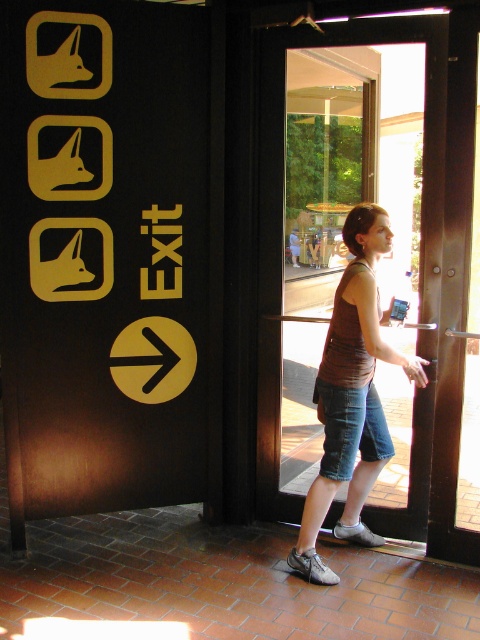
You are at the entrance of a building and need to exit. You see a matte black sign at exit right and a transparent glass door at center. Which object is taller?

The matte black sign at exit right is much taller than the transparent glass door at center.

You are standing at the entrance of a building and want to locate the matte black sign at exit right. According to the coordinates provided, where should you look relative to the door?

Result: The matte black sign at exit right is located at coordinates point [105,250], which is to the right side of the door.

You are trying to exit the building and see the matte black sign at exit right and the brown fabric tank top at center. Which object is positioned higher in the image?

The matte black sign at exit right is located above the brown fabric tank top at center, so it is positioned higher.